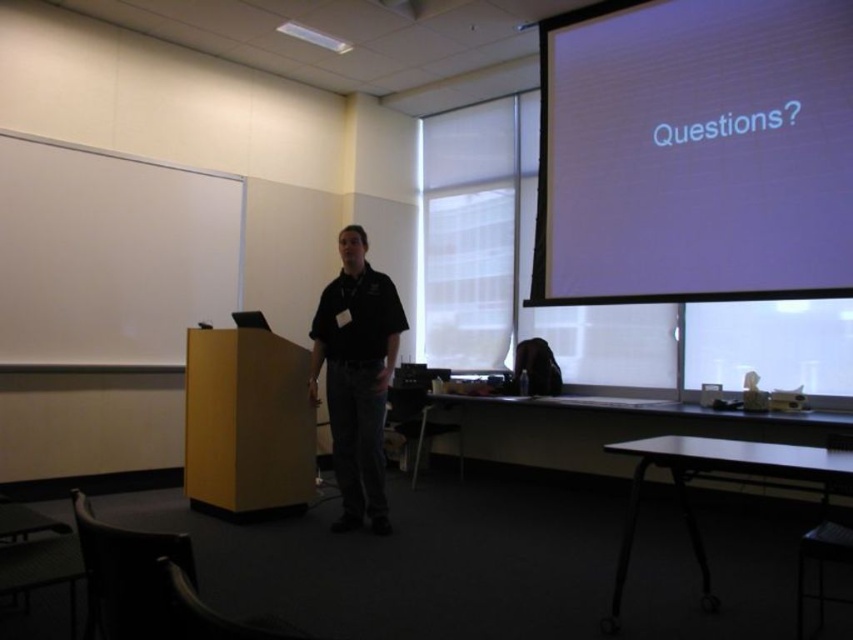
Describe the element at coordinates (694, 150) in the screenshot. I see `white matte projection screen at upper right` at that location.

Is white matte projection screen at upper right to the right of black matte shirt at center from the viewer's perspective?

Correct, you'll find white matte projection screen at upper right to the right of black matte shirt at center.

Who is more forward, (x=613, y=204) or (x=352, y=268)?

Point (x=352, y=268) is in front.

Identify the location of white matte projection screen at upper right. (694, 150).

Between yellow wood podium at left and black matte shirt at center, which one is positioned lower?

yellow wood podium at left

Which is in front, point (219, 339) or point (357, 301)?

Point (357, 301) is in front.

Locate an element on the screen. The height and width of the screenshot is (640, 853). yellow wood podium at left is located at coordinates (247, 422).

The height and width of the screenshot is (640, 853). In order to click on white matte projection screen at upper right in this screenshot , I will do `click(694, 150)`.

Measure the distance between point (729,193) and camera.

The distance of point (729,193) from camera is 4.09 meters.

Does point (701, 26) lie in front of point (260, 508)?

That is False.

In order to click on white matte projection screen at upper right in this screenshot , I will do `click(694, 150)`.